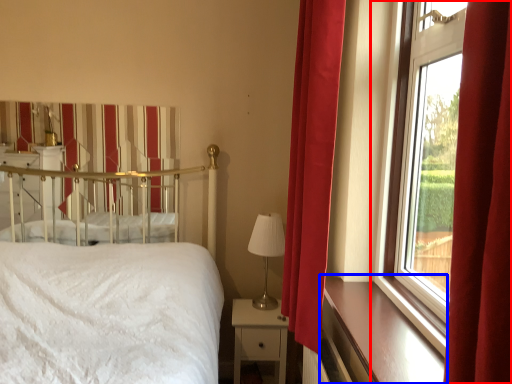
Question: Which of the following is the farthest to the observer, window (highlighted by a red box) or window sill (highlighted by a blue box)?

Choices:
 (A) window
 (B) window sill

Answer: (B)